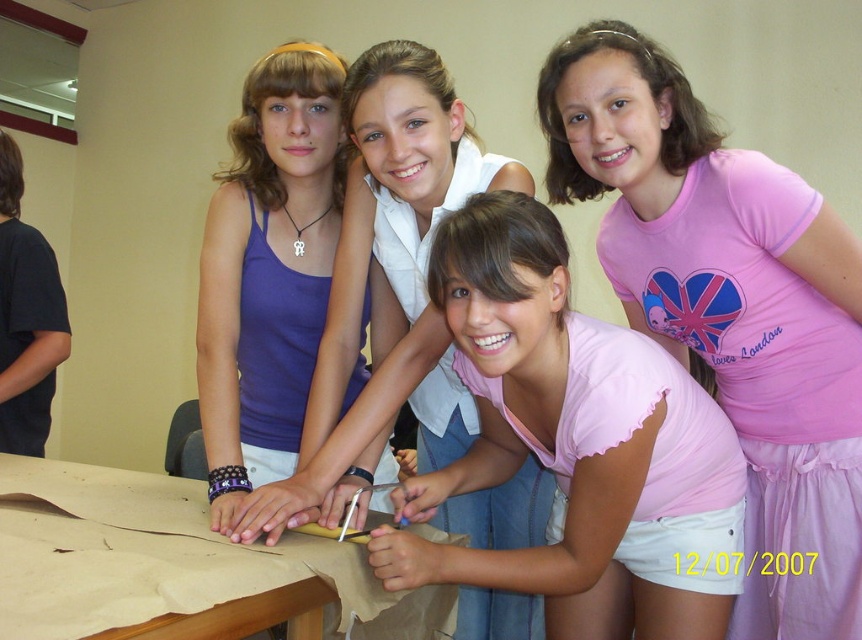
You are standing in front of the image. If you want to locate the matte blue tank top at upper left, where would you look?

The matte blue tank top at upper left is located at point (394, 268).

You are a photographer trying to capture a group photo of the girls around the table. Given that the pink fabric shirt at upper right and the brown wooden table at center are in the frame, which object takes up more area in the photo?

The brown wooden table at center occupies more area in the photo than the pink fabric shirt at upper right because the pink fabric shirt at upper right occupies less space than brown wooden table at center.

You are a photographer standing in the room. You want to take a photo of the pink fabric shirt at upper right and the brown wooden table at center. Which object is taller?

The pink fabric shirt at upper right is taller than the brown wooden table at center.